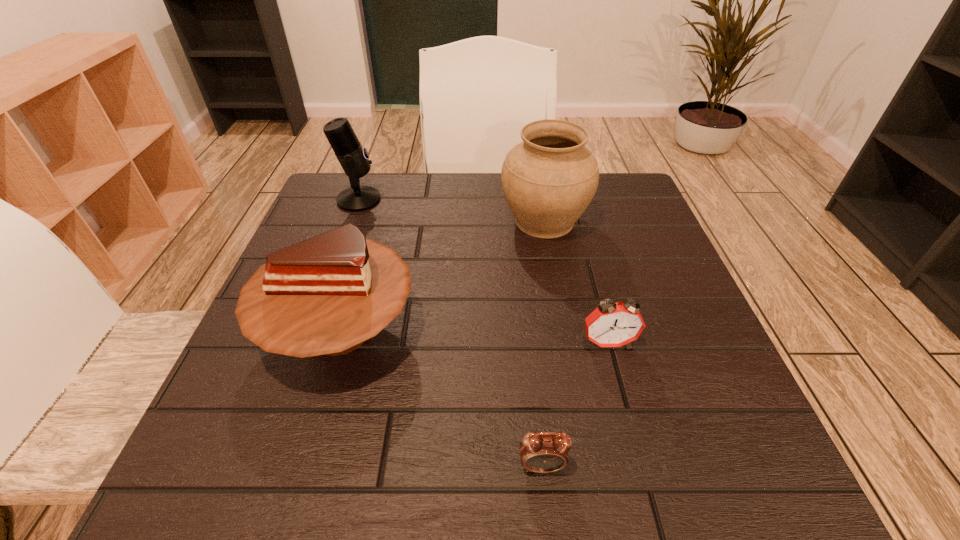
I want to click on vacant space at the far edge of the desktop, so click(x=428, y=219).

The width and height of the screenshot is (960, 540). In the image, there is a desktop. What are the coordinates of `vacant space at the right edge` in the screenshot? It's located at (605, 230).

The height and width of the screenshot is (540, 960). In the image, there is a desktop. In order to click on vacant space at the far left corner in this screenshot , I will do `click(370, 213)`.

I want to click on vacant space at the near left corner, so click(205, 482).

Find the location of a particular element. The height and width of the screenshot is (540, 960). vacant space at the far right corner is located at coordinates (628, 208).

What are the coordinates of `free space at the near right corner of the desktop` in the screenshot? It's located at (671, 447).

You are a GUI agent. You are given a task and a screenshot of the screen. Output one action in this format:
    pyautogui.click(x=<x>, y=<y>)
    Task: Click on the vacant region between the urn and the cake
    Image resolution: width=960 pixels, height=540 pixels.
    Given the screenshot: What is the action you would take?
    pyautogui.click(x=442, y=275)

Locate an element on the screen. vacant space that's between the right alarm clock and the microphone is located at coordinates (483, 271).

At what (x,y) coordinates should I click in order to perform the action: click on unoccupied area between the microphone and the urn. Please return your answer as a coordinate pair (x, y). The image size is (960, 540). Looking at the image, I should click on (451, 210).

Where is `empty space that is in between the nearest object and the right alarm clock`? Image resolution: width=960 pixels, height=540 pixels. empty space that is in between the nearest object and the right alarm clock is located at coordinates (575, 404).